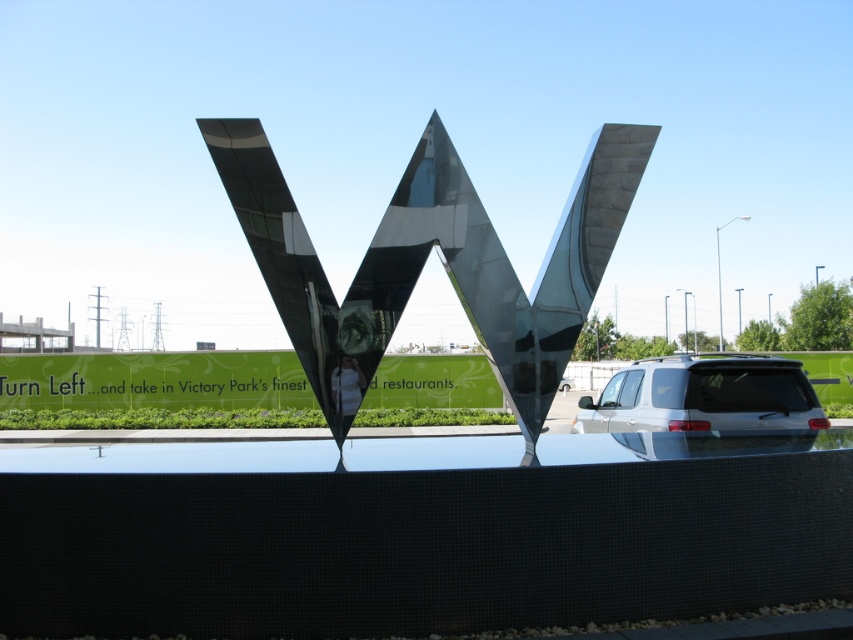
You are standing in front of the sculpture and want to take a photo of both the metallic reflective letter w at center and the brown matte letter at center. Which letter should you look up to capture in your photo?

The metallic reflective letter w at center is above the brown matte letter at center, so you should look up to capture the metallic reflective letter w at center in your photo.

You are standing in front of the sculpture and want to place a small decorative item between the two letters. Can you determine if there is enough space between the metallic reflective letter w at center and the brown matte letter at center for the item?

The metallic reflective letter w at center might be wider than brown matte letter at center, so there might not be enough space between them for the item.